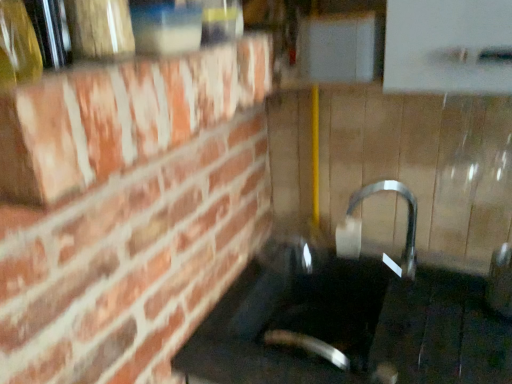
Question: Is translucent glass bottle at upper left bigger or smaller than satin nickel faucet at center?

Choices:
 (A) big
 (B) small

Answer: (B)

Question: Does point (27, 39) appear closer or farther from the camera than point (335, 236)?

Choices:
 (A) farther
 (B) closer

Answer: (B)

Question: Which object is positioned farthest from the translucent glass bottle at upper left?

Choices:
 (A) satin nickel faucet at center
 (B) black glass sink at center

Answer: (A)

Question: Estimate the real-world distances between objects in this image. Which object is farther from the translucent glass bottle at upper left?

Choices:
 (A) black glass sink at center
 (B) satin nickel faucet at center

Answer: (B)